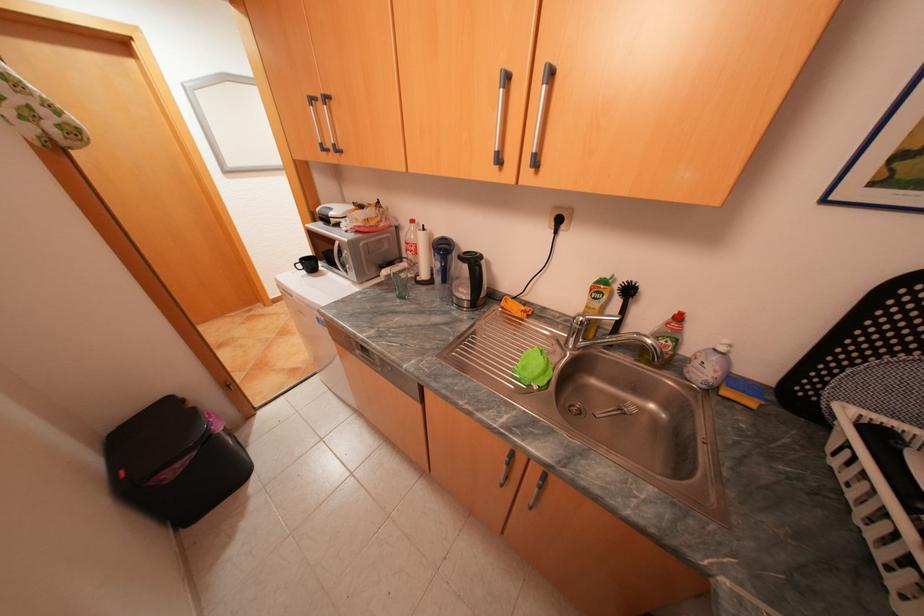
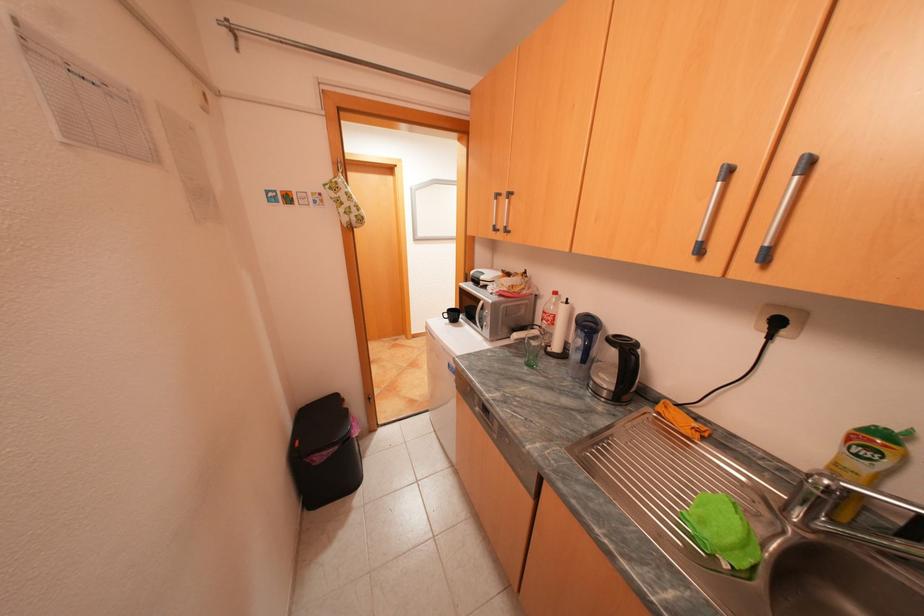
In the second image, find the point that corresponds to (310,265) in the first image.

(456, 315)